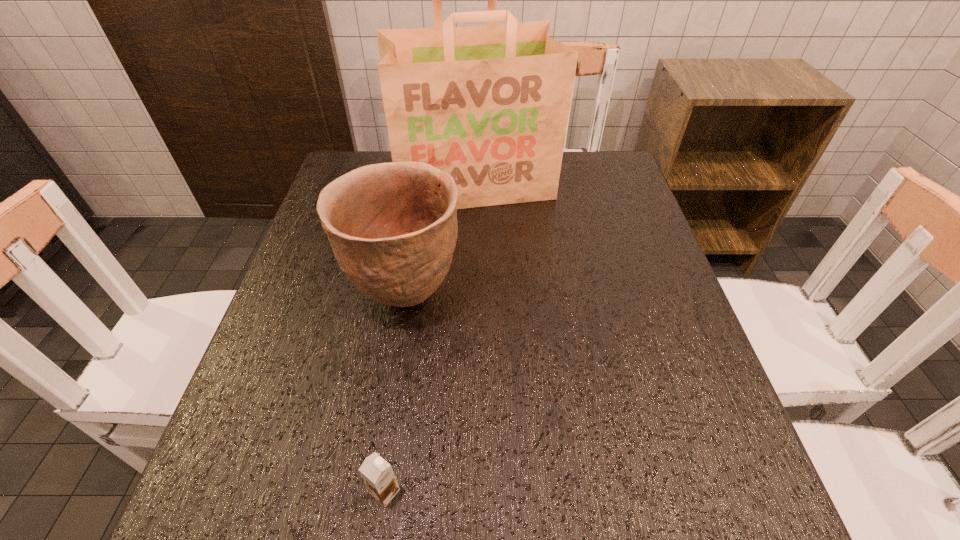
The width and height of the screenshot is (960, 540). I want to click on the farthest object, so click(x=489, y=105).

I want to click on the tallest object, so click(489, 105).

You are a GUI agent. You are given a task and a screenshot of the screen. Output one action in this format:
    pyautogui.click(x=<x>, y=<y>)
    Task: Click on the second tallest object
    Image resolution: width=960 pixels, height=540 pixels.
    Given the screenshot: What is the action you would take?
    tap(392, 227)

Image resolution: width=960 pixels, height=540 pixels. I want to click on pottery, so click(x=392, y=227).

Locate an element on the screen. the nearest object is located at coordinates (378, 475).

This screenshot has height=540, width=960. Find the location of `the shortest object`. the shortest object is located at coordinates (378, 475).

Find the location of a particular element. This screenshot has width=960, height=540. free location located on the front of the farthest object is located at coordinates click(472, 304).

At what (x,y) coordinates should I click in order to perform the action: click on vacant space situated on the back of the second nearest object. Please return your answer as a coordinate pair (x, y). The image size is (960, 540). Looking at the image, I should click on (418, 216).

Where is `free space located 0.070m on the left of the chocolate milk`? free space located 0.070m on the left of the chocolate milk is located at coordinates (324, 492).

I want to click on object present at the far edge, so click(x=489, y=105).